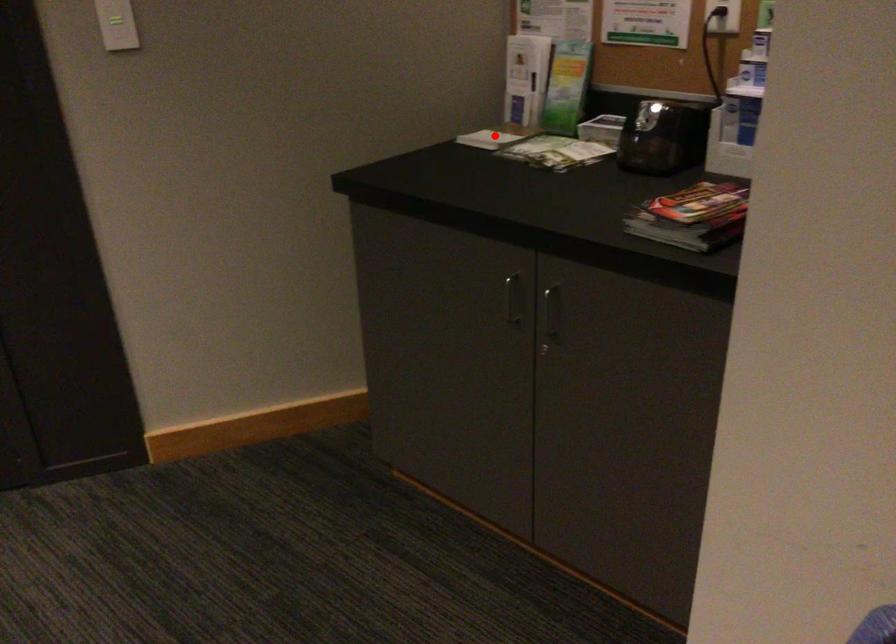
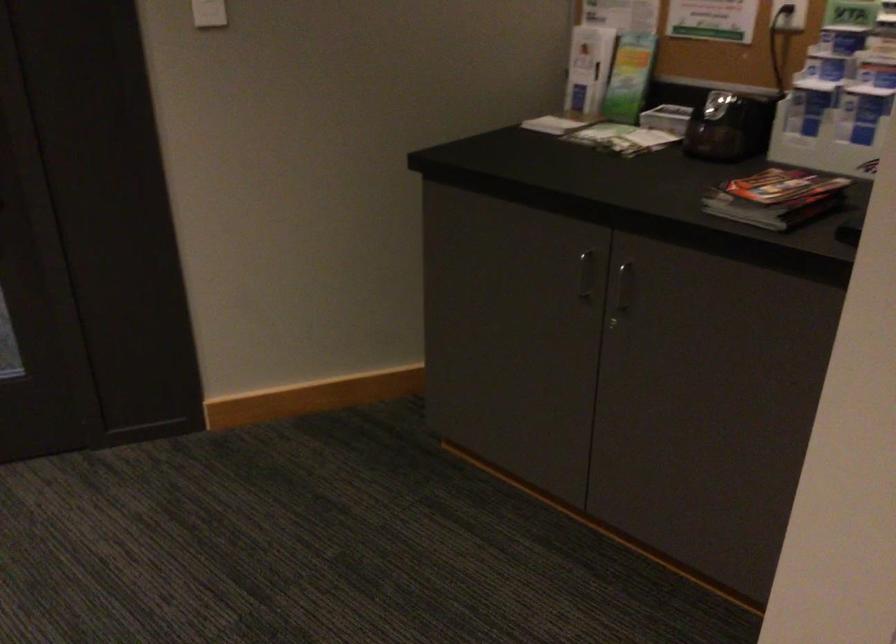
Find the pixel in the second image that matches the highlighted location in the first image.

(556, 122)